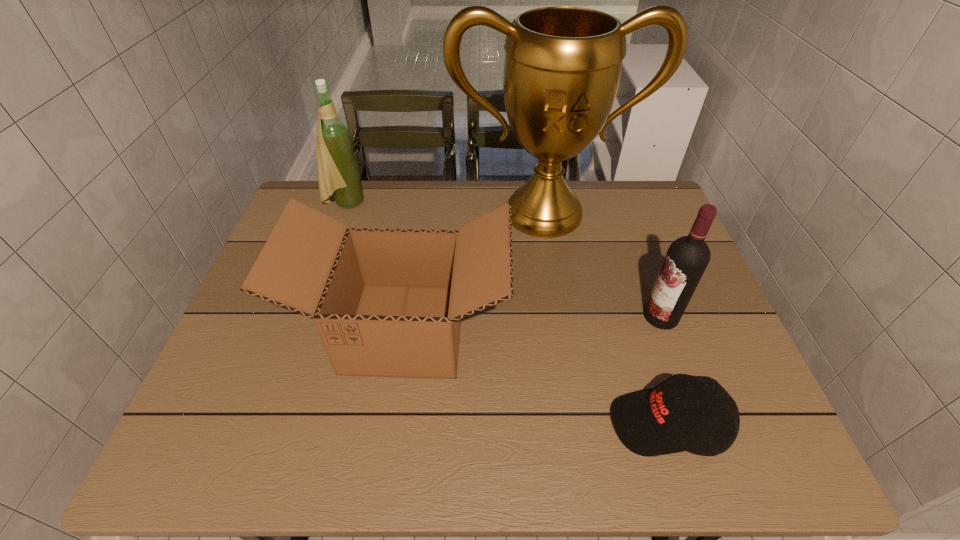
In order to click on the tallest object in this screenshot , I will do `click(562, 69)`.

You are a GUI agent. You are given a task and a screenshot of the screen. Output one action in this format:
    pyautogui.click(x=<x>, y=<y>)
    Task: Click on the farther wine bottle
    
    Given the screenshot: What is the action you would take?
    pyautogui.click(x=338, y=175)

At what (x,y) coordinates should I click in order to perform the action: click on the nearer wine bottle. Please return your answer as a coordinate pair (x, y). The width and height of the screenshot is (960, 540). Looking at the image, I should click on (687, 257).

Image resolution: width=960 pixels, height=540 pixels. I want to click on the shorter wine bottle, so click(687, 257).

The image size is (960, 540). I want to click on box, so (386, 302).

Where is `the shortest object`? the shortest object is located at coordinates [651, 422].

Identify the location of baseball cap. [x=651, y=422].

At what (x,y) coordinates should I click in order to perform the action: click on vacant space located 0.130m on the surface of the tallest object with symbols. Please return your answer as a coordinate pair (x, y). Looking at the image, I should click on (554, 275).

Find the location of a particular element. The image size is (960, 540). vacant space positioned on the front-facing side of the left wine bottle is located at coordinates (387, 204).

Where is `free space located on the label of the nearer wine bottle`? Image resolution: width=960 pixels, height=540 pixels. free space located on the label of the nearer wine bottle is located at coordinates (514, 316).